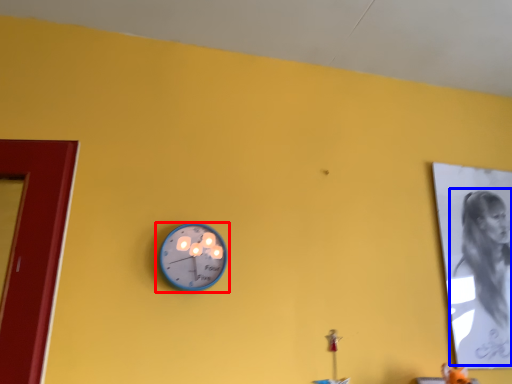
Question: Among these objects, which one is farthest to the camera, wall clock (highlighted by a red box) or person (highlighted by a blue box)?

Choices:
 (A) wall clock
 (B) person

Answer: (B)